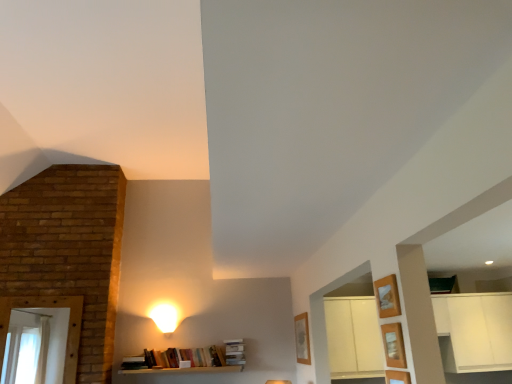
Describe the element at coordinates (165, 316) in the screenshot. I see `matte white lampshade at upper center` at that location.

At what (x,y) coordinates should I click in order to perform the action: click on wooden shelf at lower right, which is the 2th shelf in bottom-to-top order. Please return your answer as a coordinate pair (x, y). The width and height of the screenshot is (512, 384). Looking at the image, I should click on (394, 345).

Find the location of a particular element. The width and height of the screenshot is (512, 384). matte white lampshade at upper center is located at coordinates (165, 316).

Which object is thinner, wooden shelf at lower right, placed as the 3th shelf when sorted from top to bottom, or wooden frame at upper right, which ranks as the first shelf in top-to-bottom order?

wooden shelf at lower right, placed as the 3th shelf when sorted from top to bottom, is thinner.

From the image's perspective, is wooden shelf at lower right, placed as the 3th shelf when sorted from top to bottom, beneath wooden frame at upper right, acting as the 3th shelf starting from the bottom?

Correct, wooden shelf at lower right, placed as the 3th shelf when sorted from top to bottom, appears lower than wooden frame at upper right, acting as the 3th shelf starting from the bottom, in the image.

Does wooden shelf at lower right, placed as the 3th shelf when sorted from top to bottom, come in front of wooden frame at upper right, acting as the 3th shelf starting from the bottom?

Yes, the depth of wooden shelf at lower right, placed as the 3th shelf when sorted from top to bottom, is less than that of wooden frame at upper right, acting as the 3th shelf starting from the bottom.

From a real-world perspective, is wooden shelf at lower right, placed as the 3th shelf when sorted from top to bottom, under wooden frame at upper right, acting as the 3th shelf starting from the bottom?

Yes, from a real-world perspective, wooden shelf at lower right, placed as the 3th shelf when sorted from top to bottom, is beneath wooden frame at upper right, acting as the 3th shelf starting from the bottom.

The image size is (512, 384). Find the location of `shelf lying above the wooden shelf at lower right, which is the 2th shelf in bottom-to-top order (from the image's perspective)`. shelf lying above the wooden shelf at lower right, which is the 2th shelf in bottom-to-top order (from the image's perspective) is located at coordinates (387, 296).

Is wooden frame at upper right, acting as the 3th shelf starting from the bottom, far away from wooden shelf at lower right, which is counted as the second shelf, starting from the top?

wooden frame at upper right, acting as the 3th shelf starting from the bottom, is actually quite close to wooden shelf at lower right, which is counted as the second shelf, starting from the top.

Which is more to the right, wooden frame at upper right, acting as the 3th shelf starting from the bottom, or wooden shelf at lower right, which is counted as the second shelf, starting from the top?

wooden shelf at lower right, which is counted as the second shelf, starting from the top, is more to the right.

Which object is closer to the camera taking this photo, wooden shelf at lower right, which is the 2th shelf in bottom-to-top order, or matte white lampshade at upper center?

wooden shelf at lower right, which is the 2th shelf in bottom-to-top order, is in front.

Would you say wooden shelf at lower right, which is the 2th shelf in bottom-to-top order, is outside matte white lampshade at upper center?

Yes, wooden shelf at lower right, which is the 2th shelf in bottom-to-top order, is not within matte white lampshade at upper center.

Is point (402, 367) closer to viewer compared to point (166, 318)?

Yes.

From a real-world perspective, who is located lower, wooden shelf at lower right, which is the 2th shelf in bottom-to-top order, or matte white lampshade at upper center?

From a 3D spatial view, wooden shelf at lower right, which is the 2th shelf in bottom-to-top order, is below.

Who is more distant, wooden frame at upper right, acting as the 3th shelf starting from the bottom, or wooden shelf at lower right, placed as the 3th shelf when sorted from top to bottom?

wooden frame at upper right, acting as the 3th shelf starting from the bottom, is more distant.

Does point (392, 282) appear closer or farther from the camera than point (396, 382)?

Point (392, 282) appears to be farther away from the viewer than point (396, 382).

You are a GUI agent. You are given a task and a screenshot of the screen. Output one action in this format:
    pyautogui.click(x=<x>, y=<y>)
    Task: Click on the shelf that is the 2nd one when counting rightward from the wooden frame at upper right, which ranks as the first shelf in top-to-bottom order
    Image resolution: width=512 pixels, height=384 pixels.
    Given the screenshot: What is the action you would take?
    pyautogui.click(x=397, y=377)

From the image's perspective, is wooden shelf at lower right, which is counted as the second shelf, starting from the top, positioned above or below wooden frame at upper right, which ranks as the first shelf in top-to-bottom order?

wooden shelf at lower right, which is counted as the second shelf, starting from the top, is situated lower than wooden frame at upper right, which ranks as the first shelf in top-to-bottom order, in the image.

Can you tell me how much wooden shelf at lower right, which is counted as the second shelf, starting from the top, and wooden frame at upper right, which ranks as the first shelf in top-to-bottom order, differ in facing direction?

The angle between the facing direction of wooden shelf at lower right, which is counted as the second shelf, starting from the top, and the facing direction of wooden frame at upper right, which ranks as the first shelf in top-to-bottom order, is 0.0018 degrees.

From a real-world perspective, does wooden shelf at lower right, which is the 2th shelf in bottom-to-top order, stand above wooden frame at upper right, which ranks as the first shelf in top-to-bottom order?

Actually, wooden shelf at lower right, which is the 2th shelf in bottom-to-top order, is physically below wooden frame at upper right, which ranks as the first shelf in top-to-bottom order, in the real world.

Is wooden shelf at lower right, which is counted as the second shelf, starting from the top, to the left or to the right of wooden frame at upper right, which ranks as the first shelf in top-to-bottom order, in the image?

In the image, wooden shelf at lower right, which is counted as the second shelf, starting from the top, appears on the right side of wooden frame at upper right, which ranks as the first shelf in top-to-bottom order.

Which object is positioned more to the right, wooden shelf at lower right, which is the 2th shelf in bottom-to-top order, or wooden shelf at lower right, the first shelf positioned from the bottom?

Positioned to the right is wooden shelf at lower right, the first shelf positioned from the bottom.

How different are the orientations of wooden shelf at lower right, which is counted as the second shelf, starting from the top, and wooden shelf at lower right, the first shelf positioned from the bottom, in degrees?

There is a 0.00142-degree angle between the facing directions of wooden shelf at lower right, which is counted as the second shelf, starting from the top, and wooden shelf at lower right, the first shelf positioned from the bottom.

Looking at their sizes, would you say wooden shelf at lower right, which is counted as the second shelf, starting from the top, is wider or thinner than wooden shelf at lower right, the first shelf positioned from the bottom?

In the image, wooden shelf at lower right, which is counted as the second shelf, starting from the top, appears to be wider than wooden shelf at lower right, the first shelf positioned from the bottom.

Would you say wooden shelf at lower right, which is the 2th shelf in bottom-to-top order, is inside or outside wooden shelf at lower right, the first shelf positioned from the bottom?

wooden shelf at lower right, which is the 2th shelf in bottom-to-top order, is not enclosed by wooden shelf at lower right, the first shelf positioned from the bottom.

From a real-world perspective, is matte white lampshade at upper center positioned above or below wooden shelf at lower right, which is counted as the second shelf, starting from the top?

matte white lampshade at upper center is above wooden shelf at lower right, which is counted as the second shelf, starting from the top.

Would you say matte white lampshade at upper center is a long distance from wooden shelf at lower right, which is counted as the second shelf, starting from the top?

Yes, matte white lampshade at upper center and wooden shelf at lower right, which is counted as the second shelf, starting from the top, are quite far apart.

Locate an element on the screen. This screenshot has width=512, height=384. the 2nd shelf above when counting from the wooden shelf at lower right, the first shelf positioned from the bottom (from the image's perspective) is located at coordinates [387, 296].

This screenshot has width=512, height=384. I want to click on shelf on the left side of wooden shelf at lower right, which is counted as the second shelf, starting from the top, so click(387, 296).

Consider the image. Estimate the real-world distances between objects in this image. Which object is further from wooden frame at upper right, which ranks as the first shelf in top-to-bottom order, matte white lampshade at upper center or wooden shelf at lower right, which is the 2th shelf in bottom-to-top order?

The object further to wooden frame at upper right, which ranks as the first shelf in top-to-bottom order, is matte white lampshade at upper center.

Based on their spatial positions, is wooden shelf at lower right, placed as the 3th shelf when sorted from top to bottom, or wooden shelf at lower right, which is counted as the second shelf, starting from the top, further from wooden frame at upper right, acting as the 3th shelf starting from the bottom?

wooden shelf at lower right, placed as the 3th shelf when sorted from top to bottom, is positioned further to the anchor wooden frame at upper right, acting as the 3th shelf starting from the bottom.

Considering their positions, is wooden frame at upper right, which ranks as the first shelf in top-to-bottom order, positioned closer to wooden shelf at lower right, which is counted as the second shelf, starting from the top, than wooden shelf at lower right, placed as the 3th shelf when sorted from top to bottom?

wooden shelf at lower right, placed as the 3th shelf when sorted from top to bottom.

Looking at the image, which one is located closer to wooden shelf at lower right, placed as the 3th shelf when sorted from top to bottom, wooden frame at upper right, which ranks as the first shelf in top-to-bottom order, or matte white lampshade at upper center?

wooden frame at upper right, which ranks as the first shelf in top-to-bottom order, is closer to wooden shelf at lower right, placed as the 3th shelf when sorted from top to bottom.

From the image, which object appears to be farther from wooden shelf at lower right, the first shelf positioned from the bottom, wooden frame at upper right, acting as the 3th shelf starting from the bottom, or wooden shelf at lower right, which is counted as the second shelf, starting from the top?

The object further to wooden shelf at lower right, the first shelf positioned from the bottom, is wooden frame at upper right, acting as the 3th shelf starting from the bottom.

Based on the photo, from the image, which object appears to be farther from wooden shelf at lower right, which is the 2th shelf in bottom-to-top order, wooden shelf at lower right, the first shelf positioned from the bottom, or matte white lampshade at upper center?

matte white lampshade at upper center is positioned further to the anchor wooden shelf at lower right, which is the 2th shelf in bottom-to-top order.

Looking at the image, which one is located closer to matte white lampshade at upper center, wooden shelf at lower right, which is counted as the second shelf, starting from the top, or wooden frame at upper right, which ranks as the first shelf in top-to-bottom order?

wooden frame at upper right, which ranks as the first shelf in top-to-bottom order.

Based on their spatial positions, is wooden shelf at lower right, the first shelf positioned from the bottom, or wooden shelf at lower right, which is counted as the second shelf, starting from the top, further from matte white lampshade at upper center?

wooden shelf at lower right, which is counted as the second shelf, starting from the top, is positioned further to the anchor matte white lampshade at upper center.

This screenshot has height=384, width=512. What are the coordinates of `shelf between wooden shelf at lower right, which is counted as the second shelf, starting from the top, and matte white lampshade at upper center in the front-back direction` in the screenshot? It's located at click(x=387, y=296).

Locate an element on the screen. The image size is (512, 384). shelf that lies between wooden frame at upper right, acting as the 3th shelf starting from the bottom, and wooden shelf at lower right, the first shelf positioned from the bottom, from top to bottom is located at coordinates (394, 345).